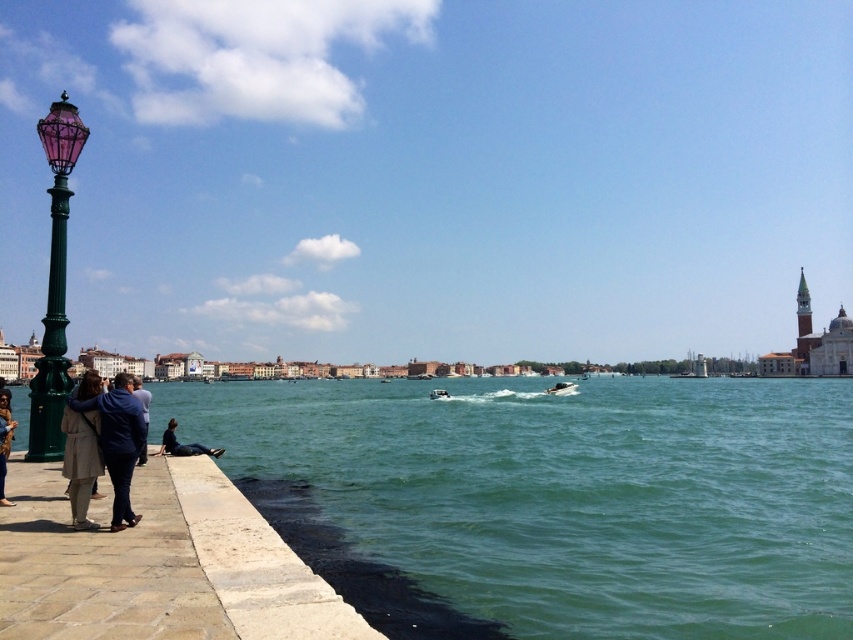
You are a delivery person carrying a package that requires a 20 meter clearance to deliver safely. You see the light beige fabric coat at lower left and the dark blue jeans at lower left in the scene. Can you safely deliver the package between them?

The light beige fabric coat at lower left and dark blue jeans at lower left are 21.34 meters apart from each other, so yes, the delivery person can safely deliver the package between them as the distance is greater than the required 20 meter clearance.

You are an architect designing a new pathway for the waterfront area. You need to place a bench between the green glass lamp post at left and the beige fabric coat at lower left. Which object should the bench be closer to to ensure it fits within the available space?

The bench should be closer to the green glass lamp post at left because it has a lesser width than the beige fabric coat at lower left, allowing more space for the bench next to it.

You are a tourist standing on the walkway and see the light beige fabric coat at lower left and dark blue jeans at lower left. Which clothing item is closer to the top of the image?

The light beige fabric coat at lower left is above dark blue jeans at lower left, so it is closer to the top of the image.